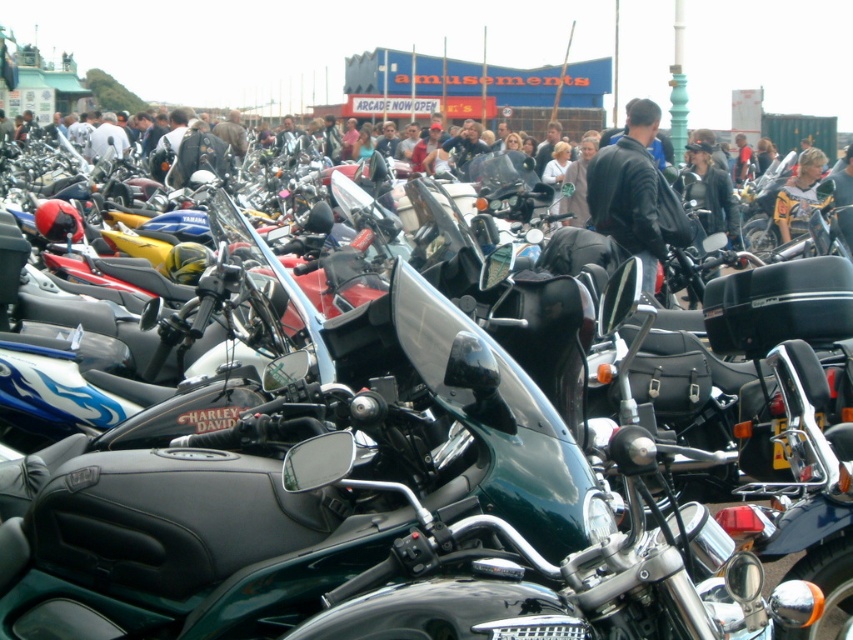
Question: Observing the image, what is the correct spatial positioning of leather jacket at center in reference to black leather jacket at center?

Choices:
 (A) below
 (B) above

Answer: (B)

Question: Which object is closer to the camera taking this photo?

Choices:
 (A) black leather jacket at center
 (B) yellow leather jacket at center

Answer: (A)

Question: Which point appears closest to the camera in this image?

Choices:
 (A) (267, 195)
 (B) (663, 189)
 (C) (816, 170)

Answer: (B)

Question: Can you confirm if leather jacket at center is positioned to the right of yellow leather jacket at center?

Choices:
 (A) yes
 (B) no

Answer: (B)

Question: Does black leather jacket at center lie in front of yellow leather jacket at center?

Choices:
 (A) yes
 (B) no

Answer: (A)

Question: Which object appears closest to the camera in this image?

Choices:
 (A) black leather jacket at center
 (B) yellow leather jacket at center
 (C) leather jacket at center

Answer: (C)